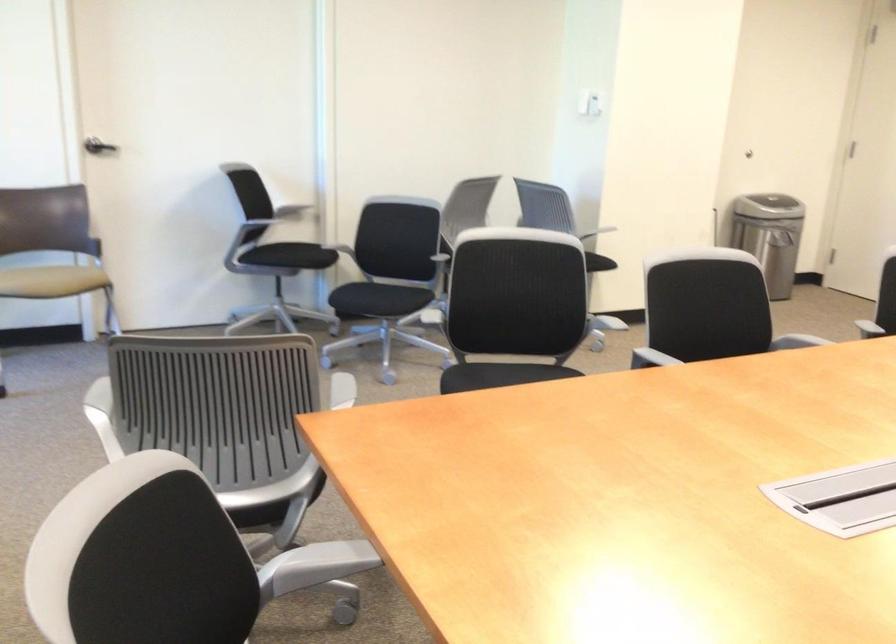
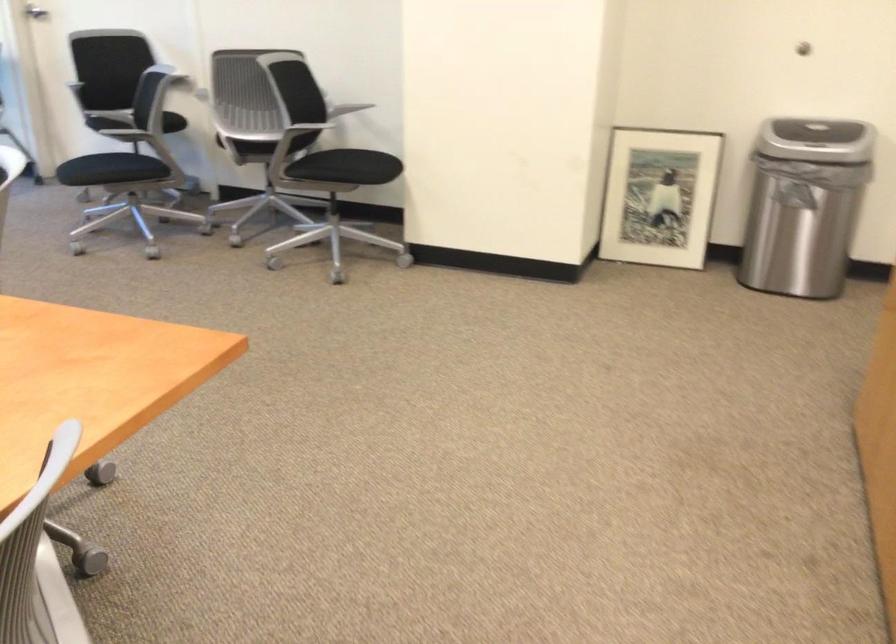
Question: I am providing you with two images of the same scene from different viewpoints. Which of the following objects are not visible in image2?

Choices:
 (A) chair sitting surface
 (B) trash can lid
 (C) chair armrest
 (D) pink stuffed toy

Answer: (C)